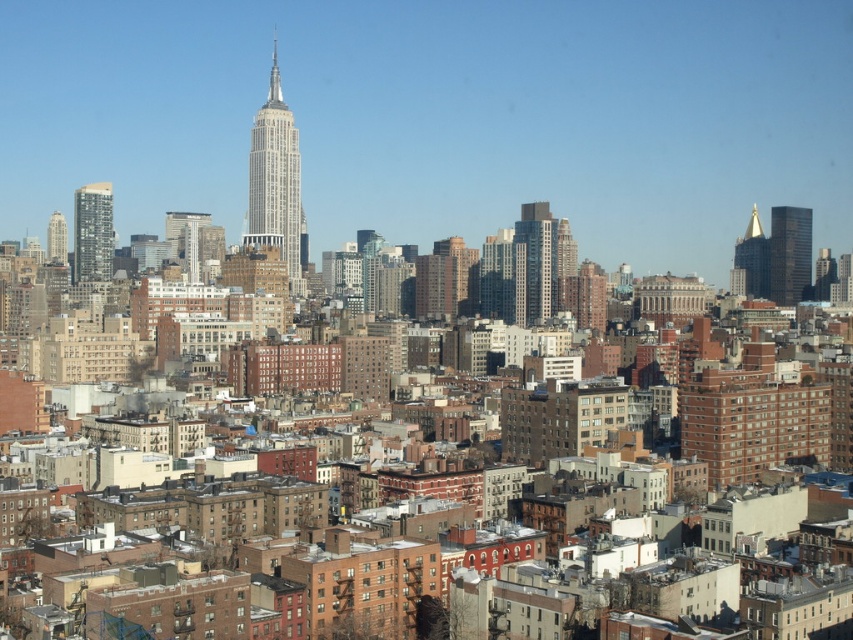
Question: Is polished steel skyscraper at center smaller than matte glass skyscraper at left?

Choices:
 (A) yes
 (B) no

Answer: (B)

Question: Does gold reflective spire at upper right have a lesser width compared to matte glass skyscraper at center?

Choices:
 (A) no
 (B) yes

Answer: (B)

Question: Considering the relative positions of shiny glass skyscraper at right and matte glass skyscraper at left in the image provided, where is shiny glass skyscraper at right located with respect to matte glass skyscraper at left?

Choices:
 (A) right
 (B) left

Answer: (A)

Question: Which of the following is the closest to the observer?

Choices:
 (A) (86, 225)
 (B) (734, 250)
 (C) (274, 60)
 (D) (527, 316)

Answer: (D)

Question: Among these objects, which one is nearest to the camera?

Choices:
 (A) matte glass skyscraper at center
 (B) shiny glass skyscraper at right
 (C) gold reflective spire at upper right

Answer: (A)

Question: Estimate the real-world distances between objects in this image. Which object is farther from the matte glass skyscraper at center?

Choices:
 (A) matte glass skyscraper at left
 (B) shiny glass skyscraper at right
 (C) gold reflective spire at upper right
 (D) glassy silver skyscraper at center

Answer: (B)